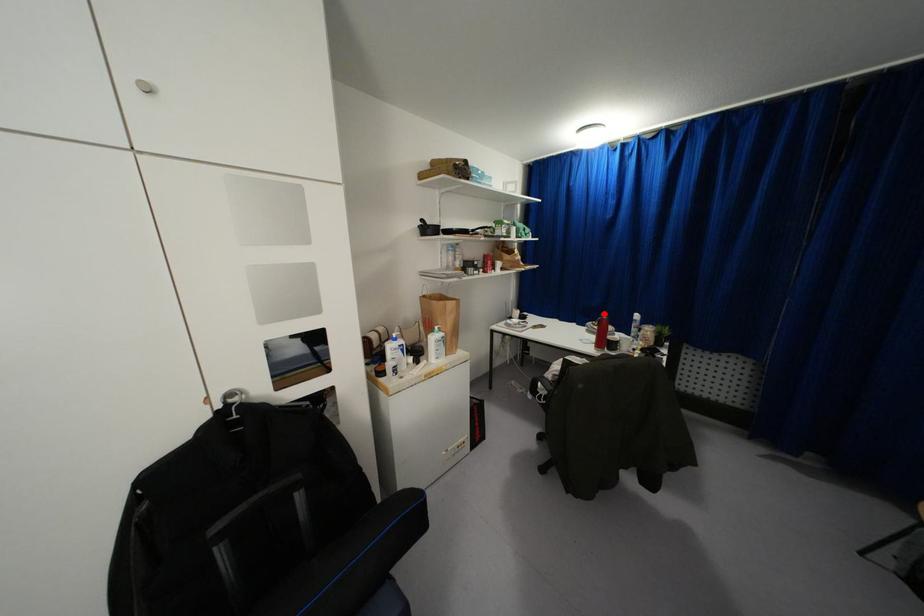
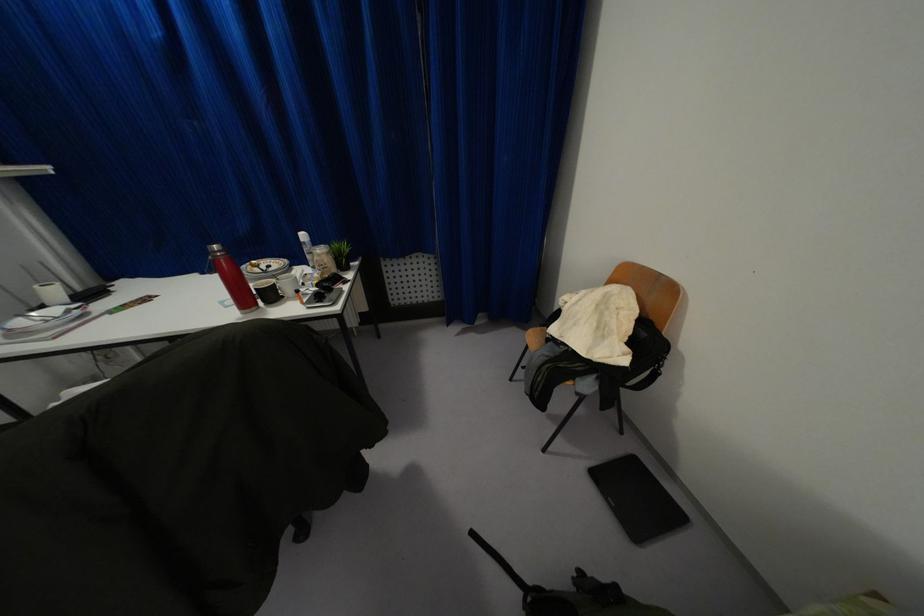
Where in the second image is the point corresponding to the highlighted location from the first image?

(214, 246)